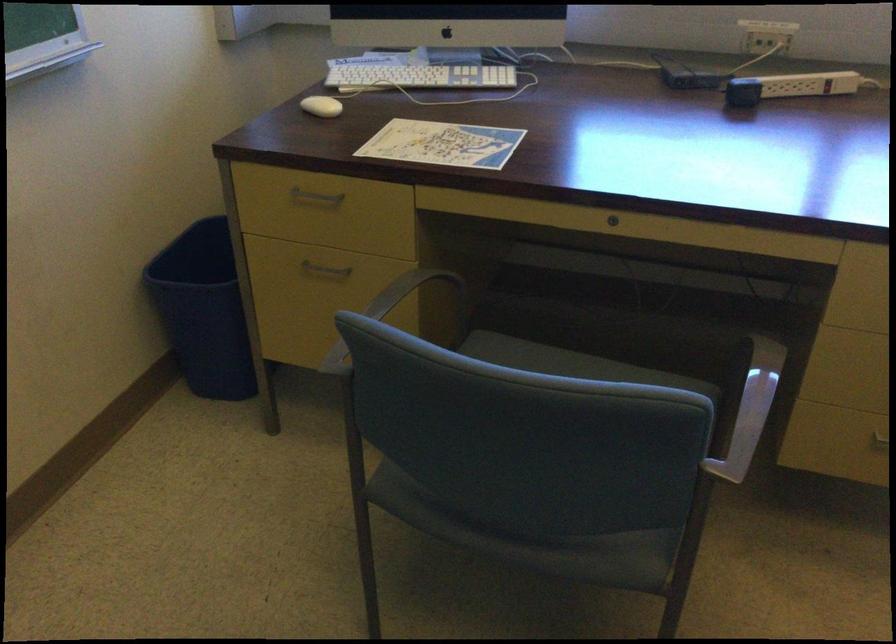
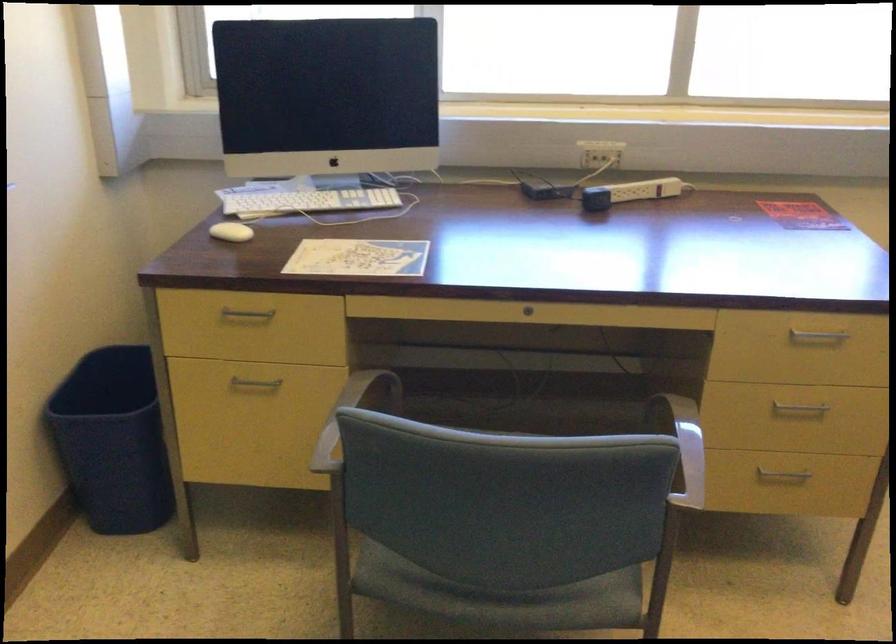
The point at (199, 308) is marked in the first image. Where is the corresponding point in the second image?

(113, 440)